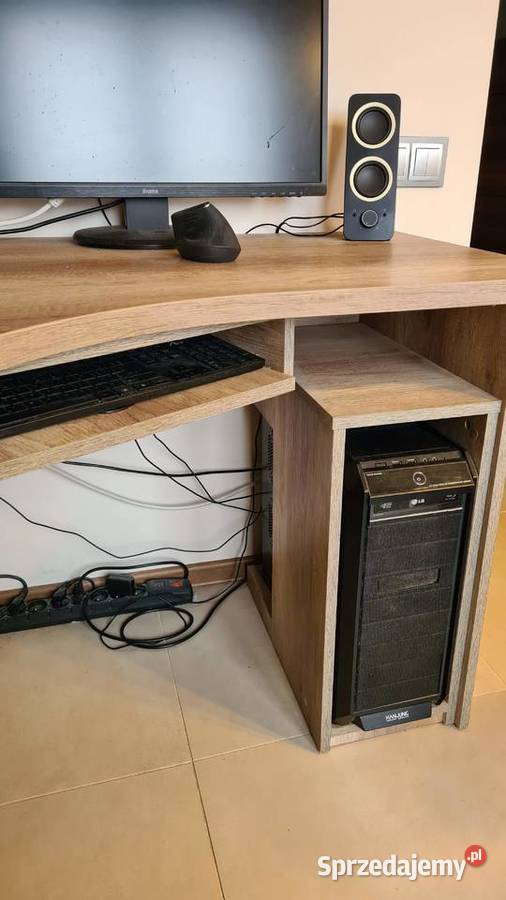
This screenshot has height=900, width=506. I want to click on wall, so click(x=145, y=520).